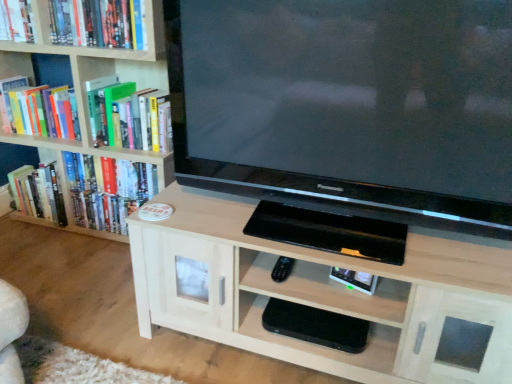
Locate an element on the screen. The height and width of the screenshot is (384, 512). hardcover book at upper left, placed as the fifth book when sorted from bottom to top is located at coordinates (16, 21).

Find the location of a particular element. black plastic shelf at lower center, which is the 2th shelf in top-to-bottom order is located at coordinates (323, 346).

The height and width of the screenshot is (384, 512). What do you see at coordinates (323, 346) in the screenshot?
I see `black plastic shelf at lower center, arranged as the first shelf when ordered from the bottom` at bounding box center [323, 346].

Find the location of a particular element. The width and height of the screenshot is (512, 384). green matte book at upper left, the 2th book from the bottom is located at coordinates (132, 118).

Considering the positions of objects hardcover book at left, which appears as the 1th book when ordered from the bottom, and light wood cabinet at center, arranged as the first shelf when viewed from the top, in the image provided, who is more to the right, hardcover book at left, which appears as the 1th book when ordered from the bottom, or light wood cabinet at center, arranged as the first shelf when viewed from the top,?

From the viewer's perspective, light wood cabinet at center, arranged as the first shelf when viewed from the top, appears more on the right side.

Is hardcover book at left, placed as the fifth book when sorted from top to bottom, far from light wood cabinet at center, arranged as the first shelf when viewed from the top?

hardcover book at left, placed as the fifth book when sorted from top to bottom, is far away from light wood cabinet at center, arranged as the first shelf when viewed from the top.

Considering the sizes of hardcover book at left, which appears as the 1th book when ordered from the bottom, and light wood cabinet at center, positioned as the 2th shelf in bottom-to-top order, in the image, is hardcover book at left, which appears as the 1th book when ordered from the bottom, wider or thinner than light wood cabinet at center, positioned as the 2th shelf in bottom-to-top order,?

In the image, hardcover book at left, which appears as the 1th book when ordered from the bottom, appears to be more narrow than light wood cabinet at center, positioned as the 2th shelf in bottom-to-top order.

Can you tell me how much hardcover book at left, which appears as the 1th book when ordered from the bottom, and light wood cabinet at center, positioned as the 2th shelf in bottom-to-top order, differ in facing direction?

hardcover book at left, which appears as the 1th book when ordered from the bottom, and light wood cabinet at center, positioned as the 2th shelf in bottom-to-top order, are facing 0.928 degrees away from each other.

Is hardcover book at left, placed as the fifth book when sorted from top to bottom, completely or partially outside of black glossy television at center?

Yes, hardcover book at left, placed as the fifth book when sorted from top to bottom, is outside of black glossy television at center.

Relative to black glossy television at center, is hardcover book at left, which appears as the 1th book when ordered from the bottom, in front or behind?

hardcover book at left, which appears as the 1th book when ordered from the bottom, is positioned farther from the viewer than black glossy television at center.

Can you tell me how much hardcover book at left, placed as the fifth book when sorted from top to bottom, and black glossy television at center differ in facing direction?

2.14 degrees separate the facing orientations of hardcover book at left, placed as the fifth book when sorted from top to bottom, and black glossy television at center.

Are hardcover book at left, which appears as the 1th book when ordered from the bottom, and black glossy television at center far apart?

That's right, there is a large distance between hardcover book at left, which appears as the 1th book when ordered from the bottom, and black glossy television at center.

Which of these two, wooden bookcase at left or hardcover book at upper left, which ranks as the third book in bottom-to-top order, is bigger?

wooden bookcase at left.

Considering the positions of objects wooden bookcase at left and hardcover book at upper left, positioned as the 3th book in top-to-bottom order, in the image provided, who is more to the right, wooden bookcase at left or hardcover book at upper left, positioned as the 3th book in top-to-bottom order,?

wooden bookcase at left.

From the image's perspective, which is below, wooden bookcase at left or hardcover book at upper left, which ranks as the third book in bottom-to-top order?

wooden bookcase at left appears lower in the image.

Between wooden bookcase at left and hardcover book at upper left, positioned as the 3th book in top-to-bottom order, which one has more height?

wooden bookcase at left is taller.

Between hardcover book at upper left, placed as the fifth book when sorted from bottom to top, and light wood cabinet at center, positioned as the 2th shelf in bottom-to-top order, which one has less height?

hardcover book at upper left, placed as the fifth book when sorted from bottom to top, is shorter.

Starting from the hardcover book at upper left, acting as the 1th book starting from the top, which shelf is the 2nd one in front? Please provide its 2D coordinates.

[(321, 292)]

How much distance is there between hardcover book at upper left, placed as the fifth book when sorted from bottom to top, and light wood cabinet at center, arranged as the first shelf when viewed from the top?

hardcover book at upper left, placed as the fifth book when sorted from bottom to top, and light wood cabinet at center, arranged as the first shelf when viewed from the top, are 1.44 meters apart.

From a real-world perspective, who is located lower, hardcover book at upper left, acting as the 1th book starting from the top, or light wood cabinet at center, positioned as the 2th shelf in bottom-to-top order?

light wood cabinet at center, positioned as the 2th shelf in bottom-to-top order.

Is black plastic shelf at lower center, arranged as the first shelf when ordered from the bottom, with hardcover book at upper left, which ranks as the third book in bottom-to-top order?

No, black plastic shelf at lower center, arranged as the first shelf when ordered from the bottom, is not in contact with hardcover book at upper left, which ranks as the third book in bottom-to-top order.

From the image's perspective, is black plastic shelf at lower center, arranged as the first shelf when ordered from the bottom, above hardcover book at upper left, which ranks as the third book in bottom-to-top order?

No, from the image's perspective, black plastic shelf at lower center, arranged as the first shelf when ordered from the bottom, is not above hardcover book at upper left, which ranks as the third book in bottom-to-top order.

Can you confirm if black plastic shelf at lower center, arranged as the first shelf when ordered from the bottom, is thinner than hardcover book at upper left, which ranks as the third book in bottom-to-top order?

Yes.

Considering the positions of objects black plastic shelf at lower center, arranged as the first shelf when ordered from the bottom, and hardcover book at upper left, which ranks as the third book in bottom-to-top order, in the image provided, who is more to the left, black plastic shelf at lower center, arranged as the first shelf when ordered from the bottom, or hardcover book at upper left, which ranks as the third book in bottom-to-top order,?

hardcover book at upper left, which ranks as the third book in bottom-to-top order, is more to the left.

Can you tell me how much light wood cabinet at center, arranged as the first shelf when viewed from the top, and black plastic shelf at lower center, arranged as the first shelf when ordered from the bottom, differ in facing direction?

The angular difference between light wood cabinet at center, arranged as the first shelf when viewed from the top, and black plastic shelf at lower center, arranged as the first shelf when ordered from the bottom, is 0.00104 degrees.

Is light wood cabinet at center, positioned as the 2th shelf in bottom-to-top order, oriented away from black plastic shelf at lower center, arranged as the first shelf when ordered from the bottom?

Yes, light wood cabinet at center, positioned as the 2th shelf in bottom-to-top order, is positioned with its back facing black plastic shelf at lower center, arranged as the first shelf when ordered from the bottom.

In terms of size, does light wood cabinet at center, positioned as the 2th shelf in bottom-to-top order, appear bigger or smaller than black plastic shelf at lower center, which is the 2th shelf in top-to-bottom order?

light wood cabinet at center, positioned as the 2th shelf in bottom-to-top order, is bigger than black plastic shelf at lower center, which is the 2th shelf in top-to-bottom order.

Who is taller, light wood cabinet at center, arranged as the first shelf when viewed from the top, or black plastic shelf at lower center, which is the 2th shelf in top-to-bottom order?

With more height is light wood cabinet at center, arranged as the first shelf when viewed from the top.

The height and width of the screenshot is (384, 512). Identify the location of the 1st shelf counting from the right side of the wooden bookcase at left. (323, 346).

Is black plastic shelf at lower center, arranged as the first shelf when ordered from the bottom, not close to wooden bookcase at left?

Yes, black plastic shelf at lower center, arranged as the first shelf when ordered from the bottom, and wooden bookcase at left are located far from each other.

Where is `book below the light wood cabinet at center, arranged as the first shelf when viewed from the top (from a real-world perspective)`? The width and height of the screenshot is (512, 384). book below the light wood cabinet at center, arranged as the first shelf when viewed from the top (from a real-world perspective) is located at coordinates (38, 193).

The width and height of the screenshot is (512, 384). Identify the location of television above the hardcover book at left, which appears as the 1th book when ordered from the bottom (from a real-world perspective). coord(349,106).

Considering their positions, is black glossy television at center positioned closer to black plastic shelf at lower center, arranged as the first shelf when ordered from the bottom, than hardcover book at left, which appears as the 1th book when ordered from the bottom?

The object closer to black plastic shelf at lower center, arranged as the first shelf when ordered from the bottom, is black glossy television at center.

Looking at the image, which one is located closer to hardcover book at left, placed as the fifth book when sorted from top to bottom, black glossy television at center or black plastic shelf at lower center, which is the 2th shelf in top-to-bottom order?

black glossy television at center lies closer to hardcover book at left, placed as the fifth book when sorted from top to bottom, than the other object.

When comparing their distances from hardcover book at upper left, which ranks as the third book in bottom-to-top order, does black glossy television at center or hardcover book at upper left, acting as the 1th book starting from the top, seem closer?

hardcover book at upper left, acting as the 1th book starting from the top, is closer to hardcover book at upper left, which ranks as the third book in bottom-to-top order.

Looking at the image, which one is located further to light wood cabinet at center, positioned as the 2th shelf in bottom-to-top order, hardcover book at left, which appears as the 1th book when ordered from the bottom, or hardcover book at upper left, which ranks as the third book in bottom-to-top order?

hardcover book at left, which appears as the 1th book when ordered from the bottom.

In the scene shown: Which object lies nearer to the anchor point wooden bookcase at left, green matte book at upper left, the fourth book positioned from the top, or hardcover book at left, which appears as the 1th book when ordered from the bottom?

green matte book at upper left, the fourth book positioned from the top, is closer to wooden bookcase at left.

Which object lies further to the anchor point hardcover book at upper left, placed as the fifth book when sorted from bottom to top, hardcover book at left, which appears as the 1th book when ordered from the bottom, or black glossy television at center?

black glossy television at center.

Considering their positions, is green matte book at upper left, the 2th book from the bottom, positioned closer to hardcover book at upper left, the 2th book positioned from the top, than hardcover book at upper left, positioned as the 3th book in top-to-bottom order?

Based on the image, green matte book at upper left, the 2th book from the bottom, appears to be nearer to hardcover book at upper left, the 2th book positioned from the top.

Which object lies further to the anchor point light wood cabinet at center, arranged as the first shelf when viewed from the top, black glossy television at center or hardcover book at upper left, the 2th book positioned from the top?

hardcover book at upper left, the 2th book positioned from the top, lies further to light wood cabinet at center, arranged as the first shelf when viewed from the top, than the other object.

Identify the location of bookcase located between hardcover book at upper left, positioned as the 3th book in top-to-bottom order, and green matte book at upper left, the fourth book positioned from the top, in the left-right direction. The image size is (512, 384). (90, 78).

Where is `bookcase located between hardcover book at upper left, placed as the fifth book when sorted from bottom to top, and black plastic shelf at lower center, arranged as the first shelf when ordered from the bottom, in the left-right direction`? Image resolution: width=512 pixels, height=384 pixels. bookcase located between hardcover book at upper left, placed as the fifth book when sorted from bottom to top, and black plastic shelf at lower center, arranged as the first shelf when ordered from the bottom, in the left-right direction is located at coordinates (90, 78).

The width and height of the screenshot is (512, 384). I want to click on bookcase between hardcover book at upper left, acting as the 1th book starting from the top, and black glossy television at center, in the horizontal direction, so click(90, 78).

Locate an element on the screen. Image resolution: width=512 pixels, height=384 pixels. book between hardcover book at upper left, which ranks as the third book in bottom-to-top order, and green matte book at upper left, the fourth book positioned from the top, from left to right is located at coordinates (97, 23).